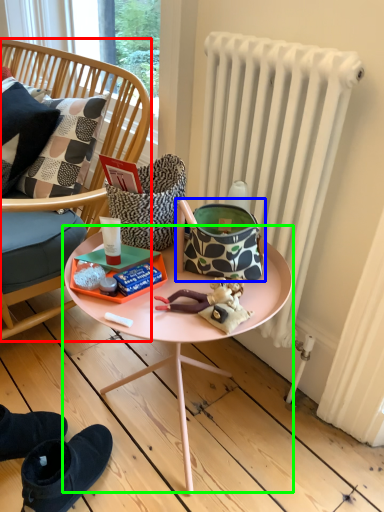
Question: Which object is the closest to the chair (highlighted by a red box)? Choose among these: handbag (highlighted by a blue box) or table (highlighted by a green box).

Choices:
 (A) handbag
 (B) table

Answer: (B)